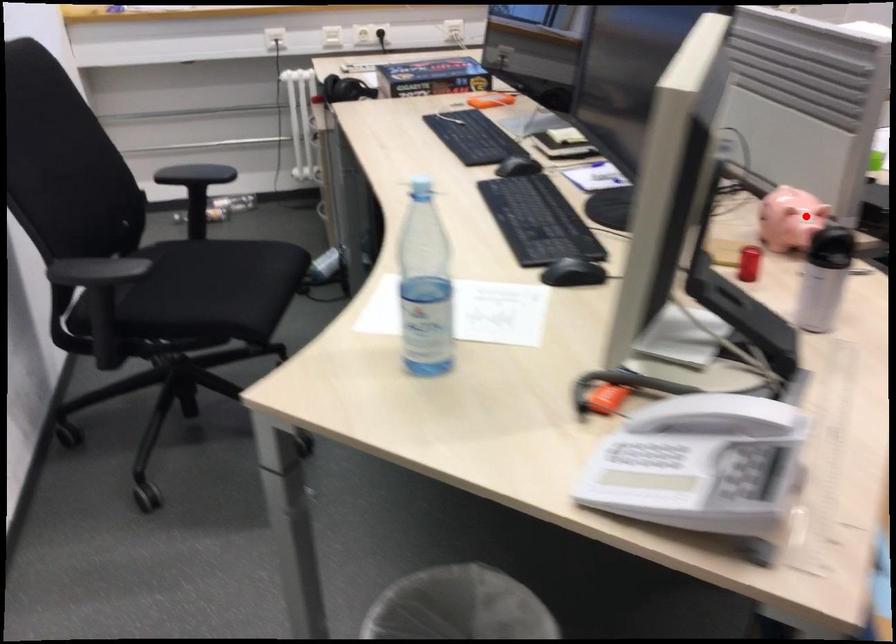
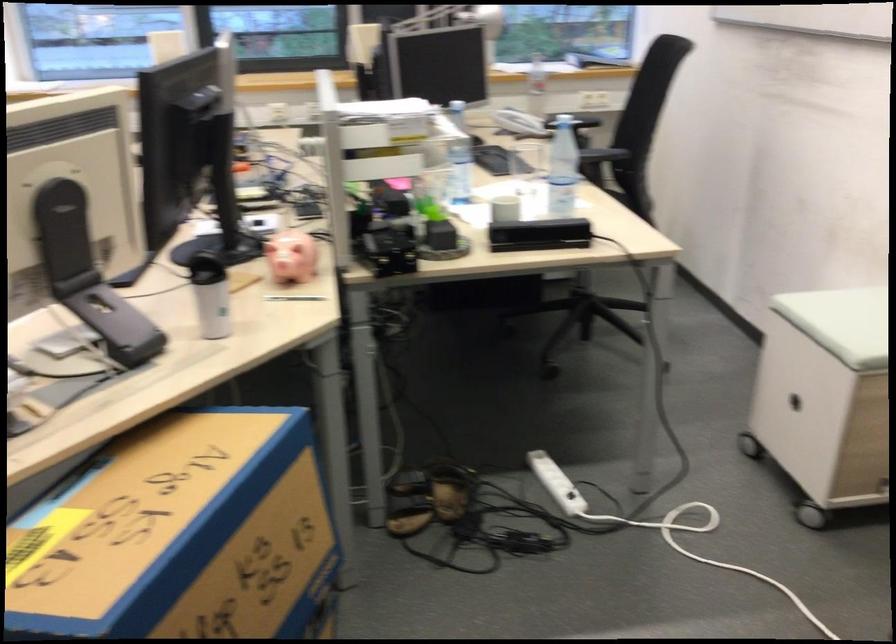
Question: I am providing you with two images of the same scene from different viewpoints. In image1, a red point is highlighted. Considering the same 3D point in image2, which of the following is correct?

Choices:
 (A) It is closer
 (B) It is farther

Answer: (B)